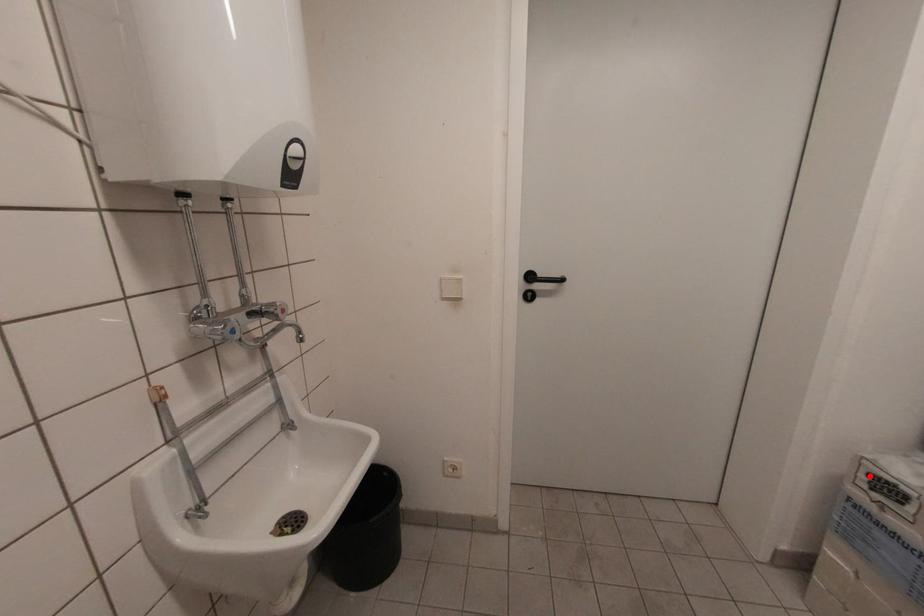
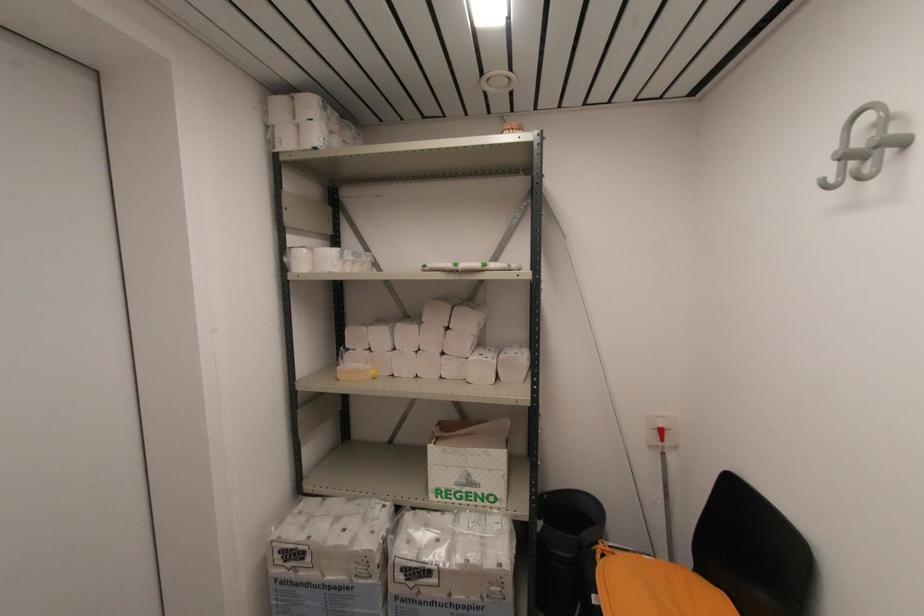
Locate, in the second image, the point that corresponds to the highlighted location in the first image.

(281, 553)